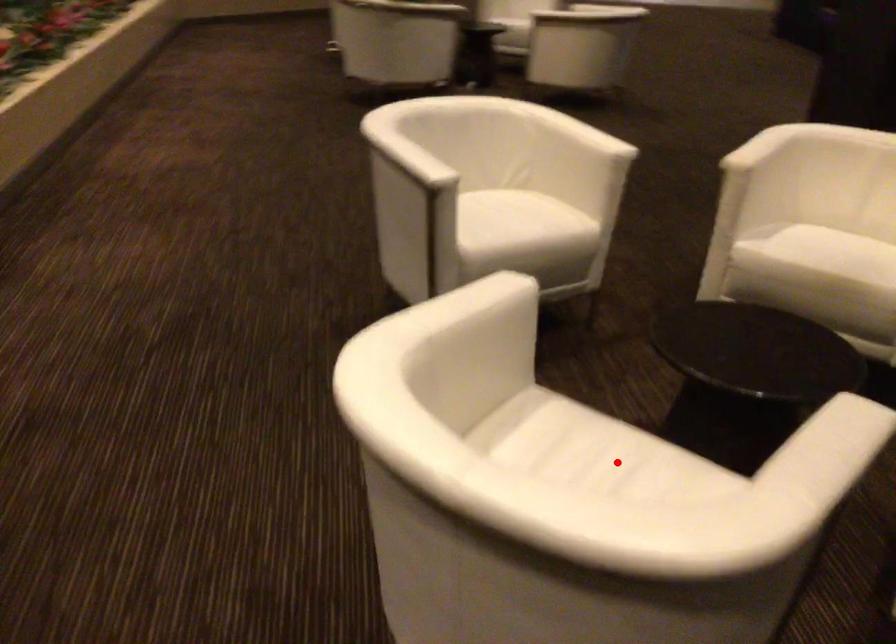
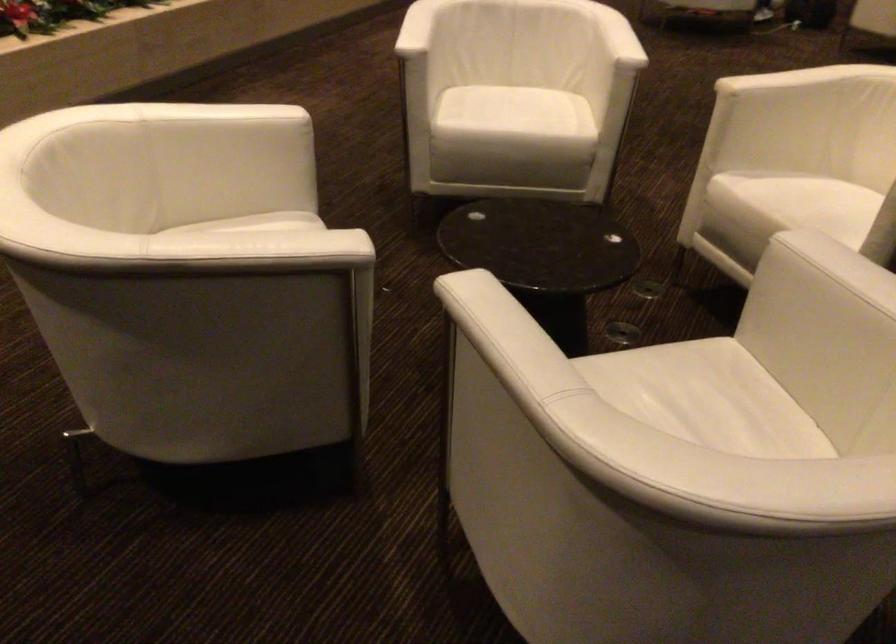
Question: I am providing you with two images of the same scene from different viewpoints. A red point is marked on the first image. Is the red point's position out of view in image 2?

Choices:
 (A) Yes
 (B) No

Answer: (A)